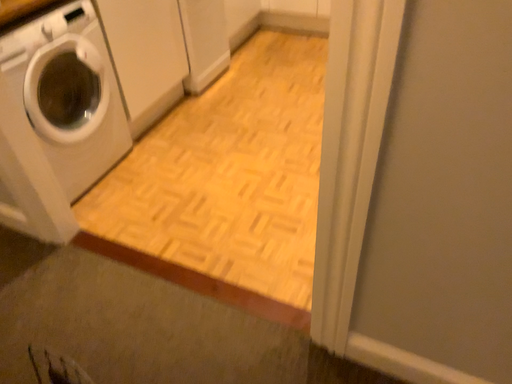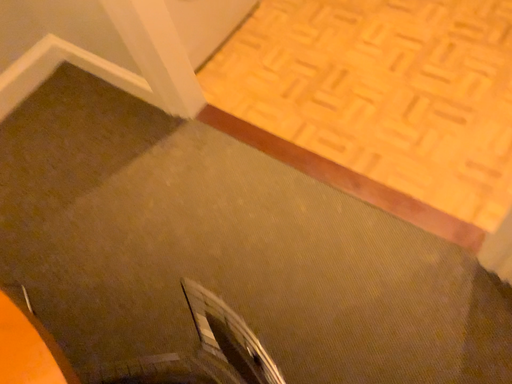
Question: How did the camera likely rotate when shooting the video?

Choices:
 (A) rotated downward
 (B) rotated upward

Answer: (A)